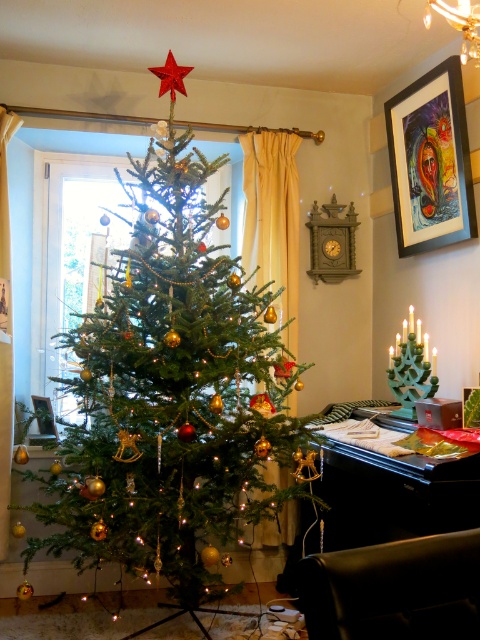
You are standing in front of the Christmas tree and want to place a small gift. You have two points marked in the image to choose from. The first point is at coordinates point (175,68) and the second is at point (54,433). Which point is closer to you so that the gift is more visible?

Point (175,68) is closer to the viewer than point (54,433), so placing the gift there would make it more visible.

You are a guest at a Christmas party and want to take a photo of the metallic red star at upper center and the brushed metal picture frame at lower left. Which object should you focus on first if you want to capture both in the same frame without moving the camera?

You should focus on the metallic red star at upper center first because it is positioned to the right of the brushed metal picture frame at lower left, so adjusting the camera to include both would require framing from the right side.

You are organizing a Christmas photo shoot and need to place a new ornament between the green matte christmas tree at center and the metallic gold picture frame at center. Based on their current positions, which object should the ornament be closer to?

The ornament should be closer to the metallic gold picture frame at center because the green matte christmas tree at center is positioned on the left side of it.